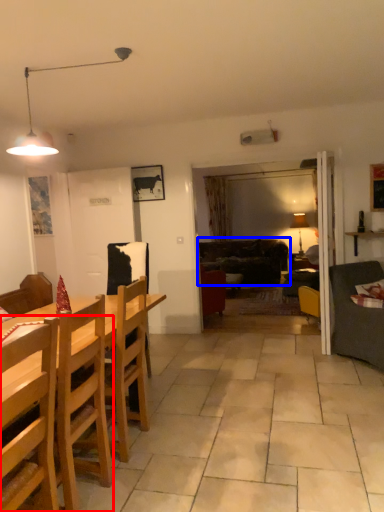
Question: Which of the following is the closest to the observer, chair (highlighted by a red box) or studio couch (highlighted by a blue box)?

Choices:
 (A) chair
 (B) studio couch

Answer: (A)